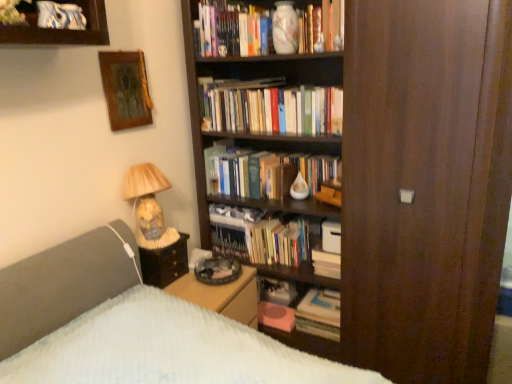
Question: Is hardcover books at center, which is the 3th book from bottom to top, wider or thinner than matte glass lamp at left?

Choices:
 (A) wide
 (B) thin

Answer: (B)

Question: From a real-world perspective, is hardcover books at center, which is the 3th book from bottom to top, physically located above or below matte glass lamp at left?

Choices:
 (A) above
 (B) below

Answer: (A)

Question: Which of these objects is positioned farthest from the hardcover book at center, marked as the first book in a bottom-to-top arrangement?

Choices:
 (A) wooden picture frame at upper left
 (B) white paper stack at center, the 2th book from the top
 (C) matte glass lamp at left
 (D) wooden screen door at right
 (E) hardcover books at center, the first book in the top-to-bottom sequence

Answer: (A)

Question: Estimate the real-world distances between objects in this image. Which object is farther from the hardcover book at center, the 3th book positioned from the top?

Choices:
 (A) white paper stack at center, the 2th book from the top
 (B) wooden picture frame at upper left
 (C) wooden side table at lower left
 (D) matte glass lamp at left
 (E) white matte paperback book at center

Answer: (B)